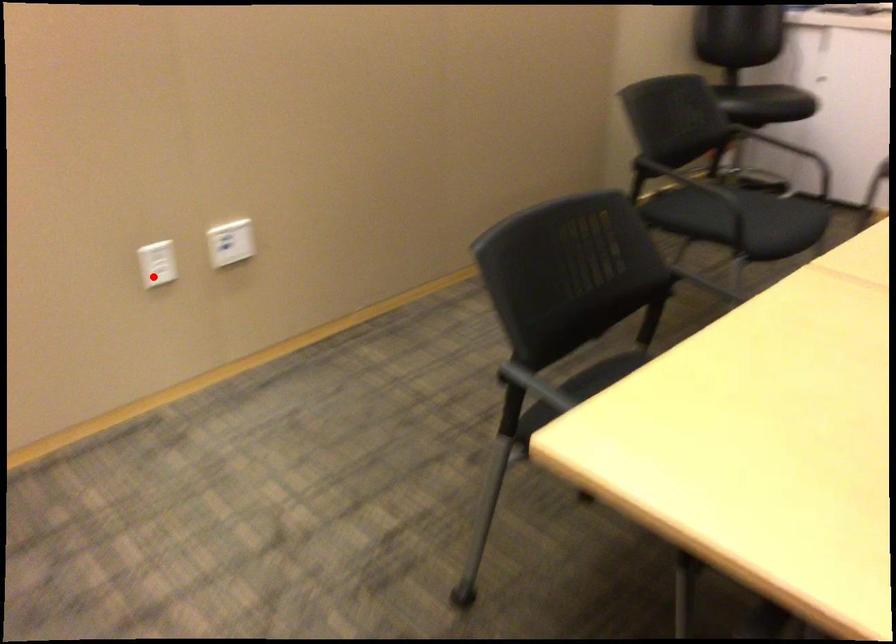
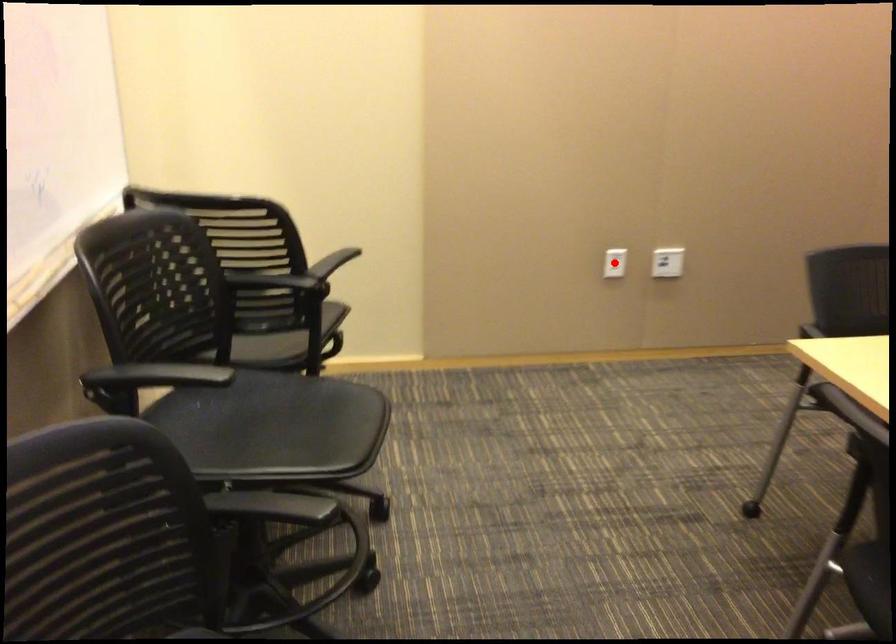
I am providing you with two images of the same scene from different viewpoints. A red point is marked on the first image and another point is marked on the second image. Does the point marked in image1 correspond to the same location as the one in image2?

Yes